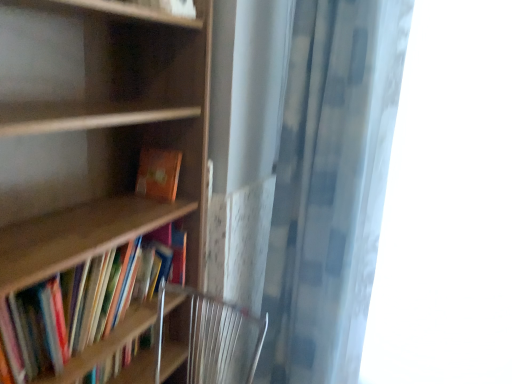
Question: Considering the relative sizes of checkered fabric shower curtain at right and wooden bookshelf at left, which appears as the 1th book when ordered from the bottom, in the image provided, is checkered fabric shower curtain at right wider than wooden bookshelf at left, which appears as the 1th book when ordered from the bottom,?

Choices:
 (A) no
 (B) yes

Answer: (B)

Question: From the image's perspective, does checkered fabric shower curtain at right appear lower than wooden bookshelf at left, which appears as the 2th book when viewed from the top?

Choices:
 (A) yes
 (B) no

Answer: (B)

Question: Is checkered fabric shower curtain at right to the left of wooden bookshelf at left, which appears as the 2th book when viewed from the top, from the viewer's perspective?

Choices:
 (A) yes
 (B) no

Answer: (B)

Question: Can you confirm if checkered fabric shower curtain at right is bigger than wooden bookshelf at left, which appears as the 2th book when viewed from the top?

Choices:
 (A) yes
 (B) no

Answer: (A)

Question: Could wooden bookshelf at left, which appears as the 1th book when ordered from the bottom, be considered to be inside checkered fabric shower curtain at right?

Choices:
 (A) yes
 (B) no

Answer: (B)

Question: Is the depth of checkered fabric shower curtain at right less than that of wooden bookshelf at left, which appears as the 1th book when ordered from the bottom?

Choices:
 (A) yes
 (B) no

Answer: (B)

Question: Does wooden bookcase at left come in front of orange matte book at center, the first book positioned from the top?

Choices:
 (A) yes
 (B) no

Answer: (A)

Question: Is wooden bookcase at left aimed at orange matte book at center, the first book positioned from the top?

Choices:
 (A) yes
 (B) no

Answer: (A)

Question: Is wooden bookcase at left in contact with orange matte book at center, which is the 2th book in bottom-to-top order?

Choices:
 (A) no
 (B) yes

Answer: (A)

Question: Is wooden bookcase at left bigger than orange matte book at center, the first book positioned from the top?

Choices:
 (A) no
 (B) yes

Answer: (B)

Question: Would you say wooden bookcase at left is a long distance from orange matte book at center, the first book positioned from the top?

Choices:
 (A) yes
 (B) no

Answer: (B)

Question: Can you confirm if wooden bookcase at left is wider than orange matte book at center, the first book positioned from the top?

Choices:
 (A) yes
 (B) no

Answer: (A)

Question: From a real-world perspective, is wooden bookshelf at left, which appears as the 2th book when viewed from the top, beneath transparent fabric at right?

Choices:
 (A) no
 (B) yes

Answer: (B)